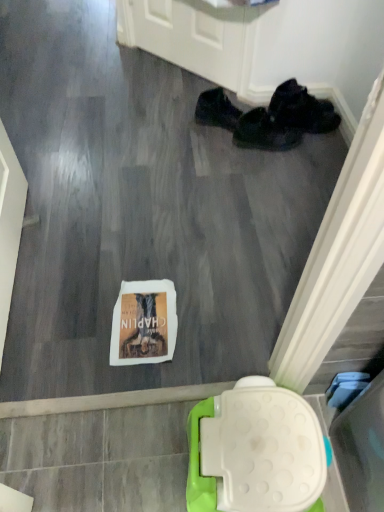
The image size is (384, 512). What are the coordinates of `vacant space in front of black fabric shoes at center, the second footwear positioned from the left` in the screenshot? It's located at (262, 170).